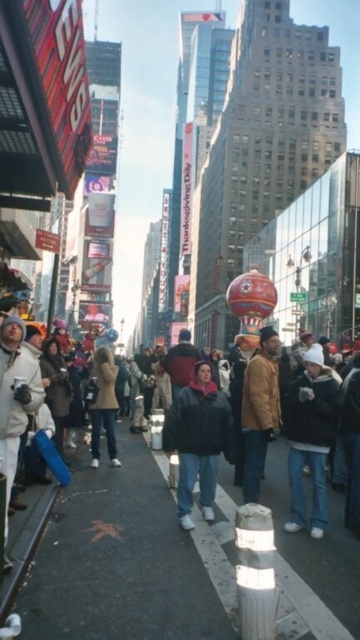
Between brown leather jacket at center and dark brown leather jacket at center, which one has less height?

dark brown leather jacket at center is shorter.

Can you confirm if brown leather jacket at center is positioned to the right of dark brown leather jacket at center?

Correct, you'll find brown leather jacket at center to the right of dark brown leather jacket at center.

Looking at this image, who is more forward, [246,369] or [105,392]?

Point [246,369]

Find the location of a particular element. Image resolution: width=360 pixels, height=640 pixels. brown leather jacket at center is located at coordinates (259, 410).

Who is taller, dark gray jacket at center or white fleece jacket at center?

dark gray jacket at center

This screenshot has width=360, height=640. What do you see at coordinates (15, 365) in the screenshot? I see `dark gray jacket at center` at bounding box center [15, 365].

Find the location of a particular element. dark gray jacket at center is located at coordinates (15, 365).

Measure the distance between dark gray jacket at center and camera.

They are 26.65 meters apart.

You are a GUI agent. You are given a task and a screenshot of the screen. Output one action in this format:
    pyautogui.click(x=<x>, y=<y>)
    Task: Click on the dark gray jacket at center
    This screenshot has width=360, height=640.
    Given the screenshot: What is the action you would take?
    pyautogui.click(x=15, y=365)